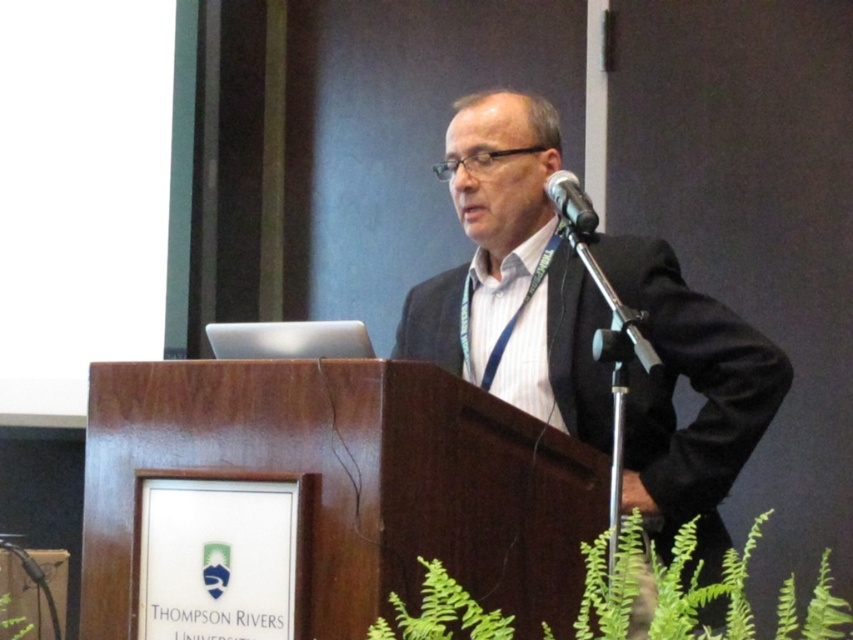
Which is more to the left, black suit at center or black metallic microphone at upper center?

From the viewer's perspective, black suit at center appears more on the left side.

Measure the distance between black suit at center and black metallic microphone at upper center.

11.01 inches

Does point (601, 260) lie in front of point (587, 196)?

No, it is behind (587, 196).

This screenshot has width=853, height=640. Identify the location of black suit at center. (512, 275).